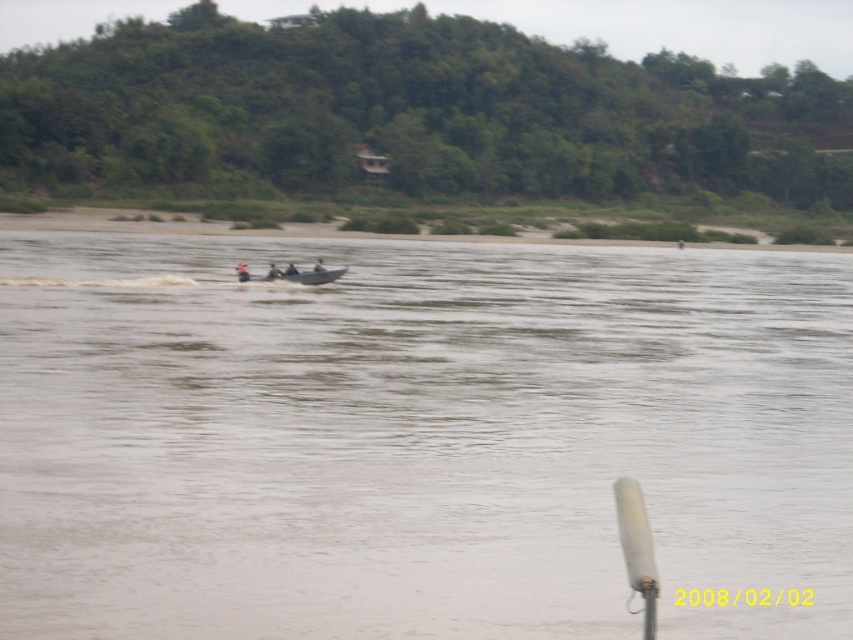
Question: In this image, where is brown muddy water at center located relative to gray plastic boat at center?

Choices:
 (A) left
 (B) right

Answer: (B)

Question: Which of the following is the farthest from the observer?

Choices:
 (A) brown muddy water at center
 (B) smooth gray boat at center
 (C) orange life vest at center
 (D) gray plastic boat at center

Answer: (B)

Question: Which point appears farthest from the camera in this image?

Choices:
 (A) (286, 275)
 (B) (245, 269)
 (C) (119, 260)

Answer: (C)

Question: Is the position of smooth gray boat at center less distant than that of dark blue fabric person at center?

Choices:
 (A) yes
 (B) no

Answer: (B)

Question: Can you confirm if brown muddy water at center is thinner than orange life vest at center?

Choices:
 (A) no
 (B) yes

Answer: (A)

Question: Estimate the real-world distances between objects in this image. Which object is closer to the brown muddy water at center?

Choices:
 (A) dark blue fabric person at center
 (B) orange life vest at center

Answer: (B)